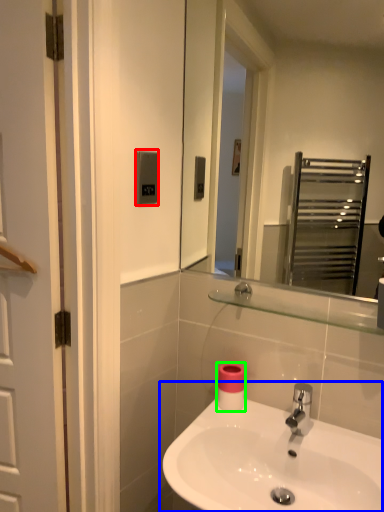
Question: Estimate the real-world distances between objects in this image. Which object is farther from light switch (highlighted by a red box), sink (highlighted by a blue box) or toilet paper (highlighted by a green box)?

Choices:
 (A) sink
 (B) toilet paper

Answer: (A)